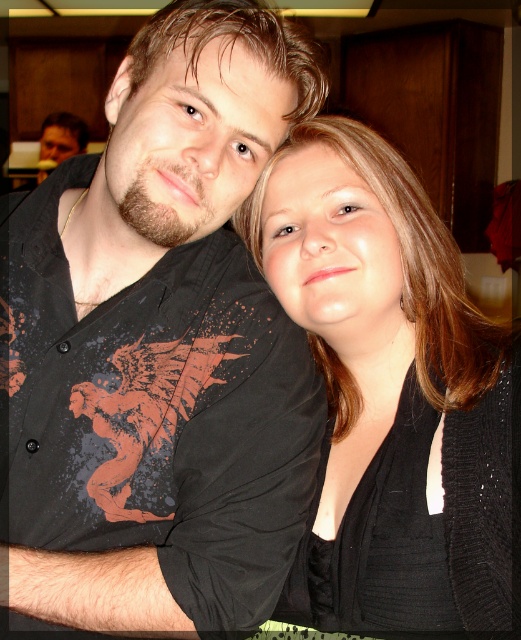
You are a photographer trying to adjust the lighting for a photo shoot. You need to place a spotlight at the exact center of the black matte shirt at upper left. What are the coordinates where you should position the spotlight?

The coordinates for the center of the black matte shirt at upper left are at point (x=157, y=348).